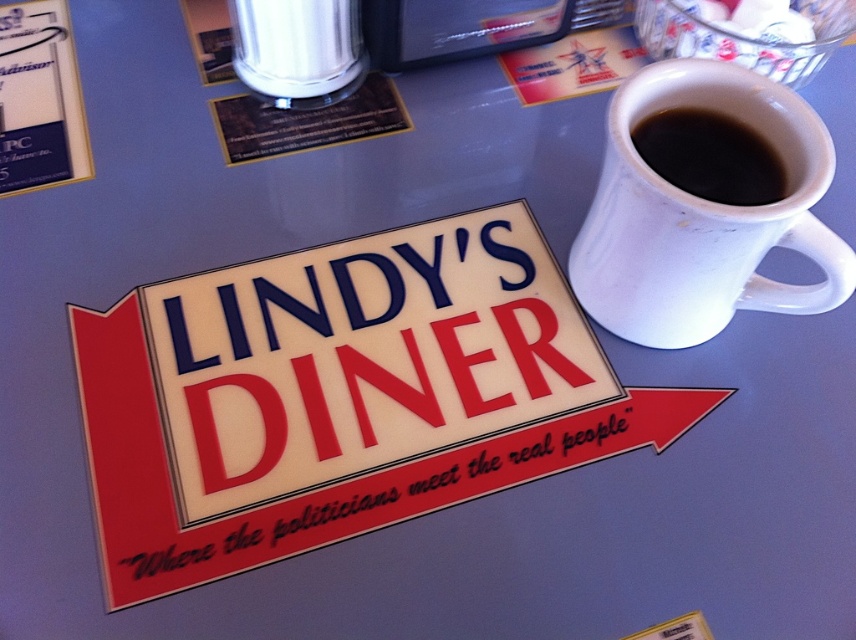
Can you confirm if white matte mug at upper right is wider than black matte mug at upper right?

Yes.

Does white matte mug at upper right lie behind black matte mug at upper right?

No, white matte mug at upper right is in front of black matte mug at upper right.

Who is more distant from viewer, (705, 61) or (700, 170)?

The point (705, 61) is more distant.

This screenshot has width=856, height=640. What are the coordinates of `white matte mug at upper right` in the screenshot? It's located at (702, 216).